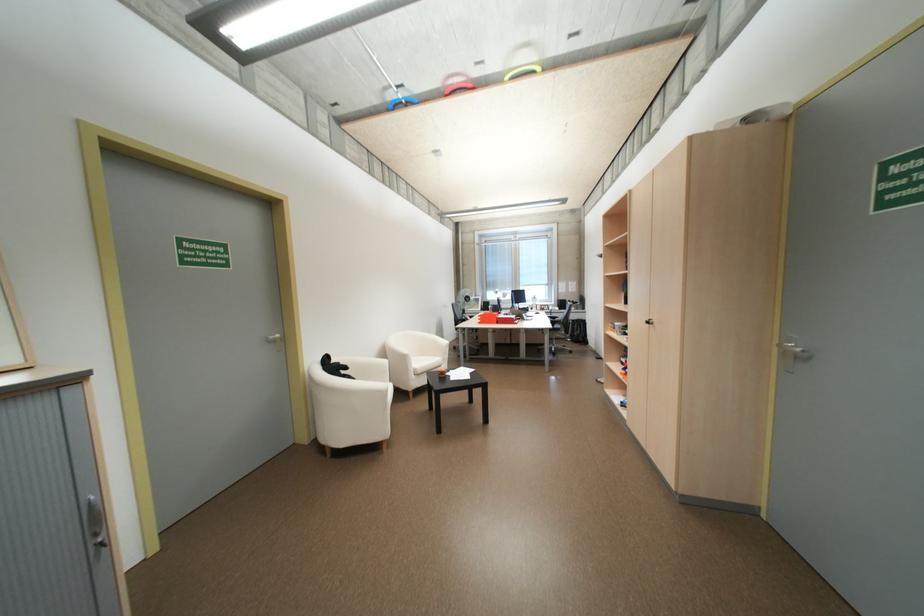
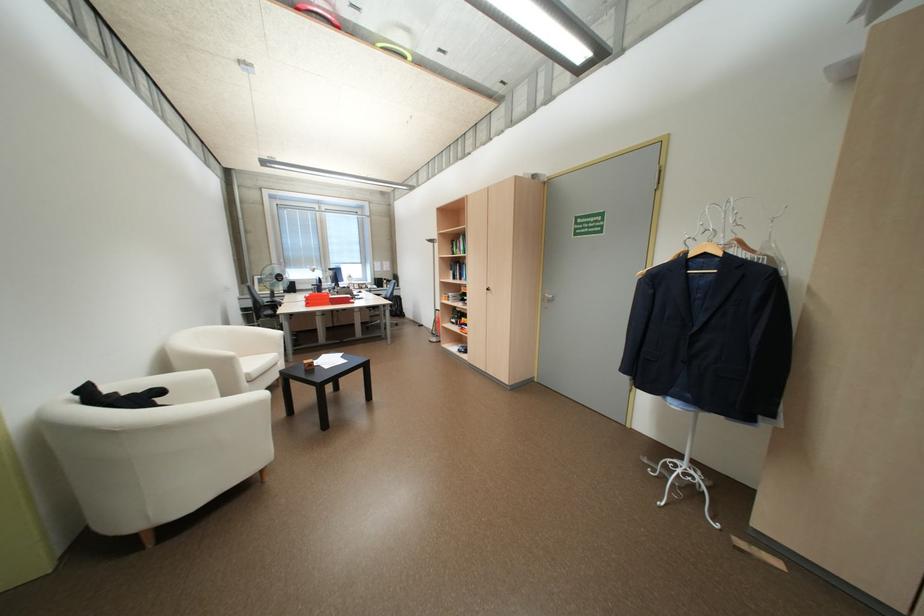
Locate, in the second image, the point that corresponds to the point at 356,367 in the first image.

(169, 392)